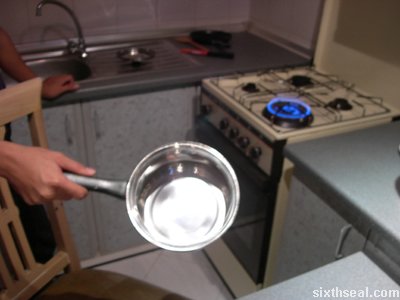
This screenshot has width=400, height=300. I want to click on cabinets, so click(x=53, y=126), click(x=136, y=122), click(x=309, y=220), click(x=376, y=252).